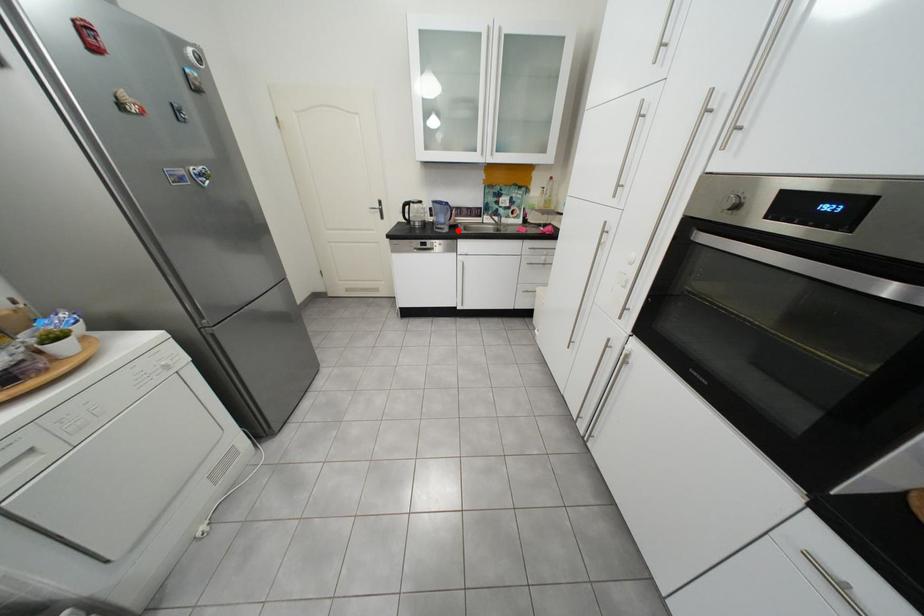
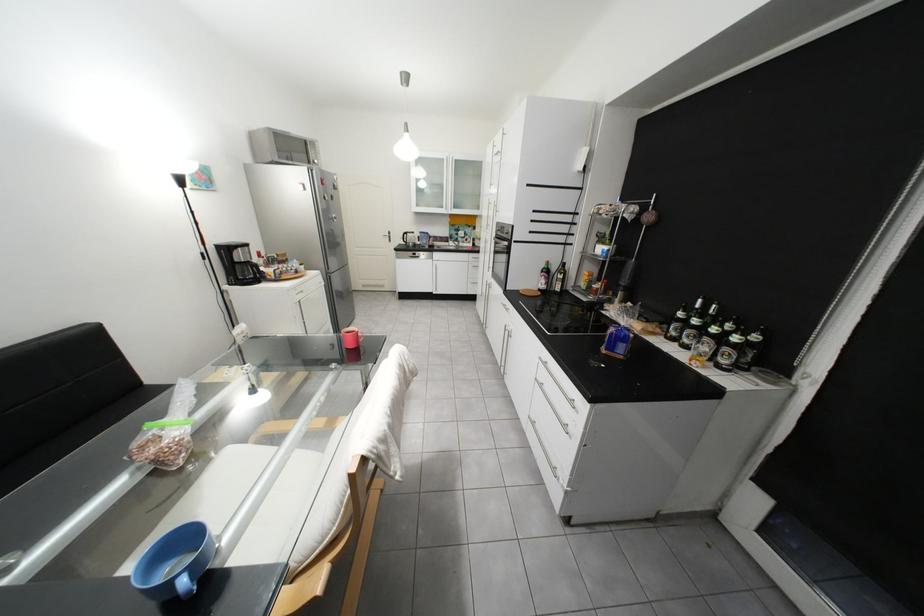
Find the pixel in the second image that matches the highlighted location in the first image.

(439, 248)